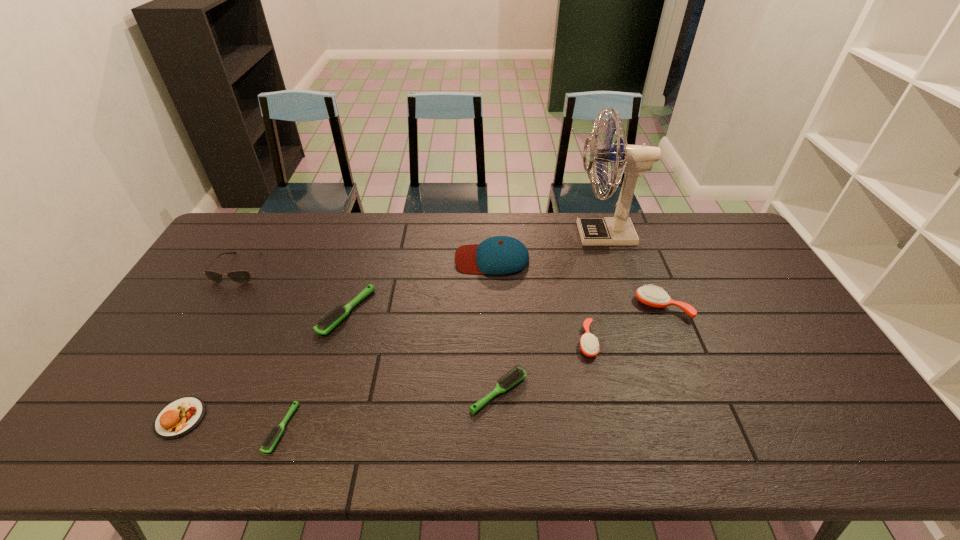
Identify which hairbrush is located as the fourth nearest to the patty (food). Please provide its 2D coordinates. Your answer should be formatted as a tuple, i.e. [(x, y)], where the tuple contains the x and y coordinates of a point satisfying the conditions above.

[(589, 344)]

Choose which hairbrush is the nearest neighbor to the sunglasses. Please provide its 2D coordinates. Your answer should be formatted as a tuple, i.e. [(x, y)], where the tuple contains the x and y coordinates of a point satisfying the conditions above.

[(329, 320)]

Locate which light hairbrush ranks second in proximity to the biggest light hairbrush. Please provide its 2D coordinates. Your answer should be formatted as a tuple, i.e. [(x, y)], where the tuple contains the x and y coordinates of a point satisfying the conditions above.

[(517, 374)]

This screenshot has height=540, width=960. I want to click on light hairbrush that is the second closest to the nearer orange hairbrush, so click(329, 320).

Where is `free spot that satisfies the following two spatial constraints: 1. on the back side of the patty (food); 2. on the right side of the tallest hairbrush`? The height and width of the screenshot is (540, 960). free spot that satisfies the following two spatial constraints: 1. on the back side of the patty (food); 2. on the right side of the tallest hairbrush is located at coordinates (240, 307).

Locate an element on the screen. The width and height of the screenshot is (960, 540). free space that satisfies the following two spatial constraints: 1. with the bill of the baseball cap facing forward; 2. on the left side of the nearer orange hairbrush is located at coordinates (494, 341).